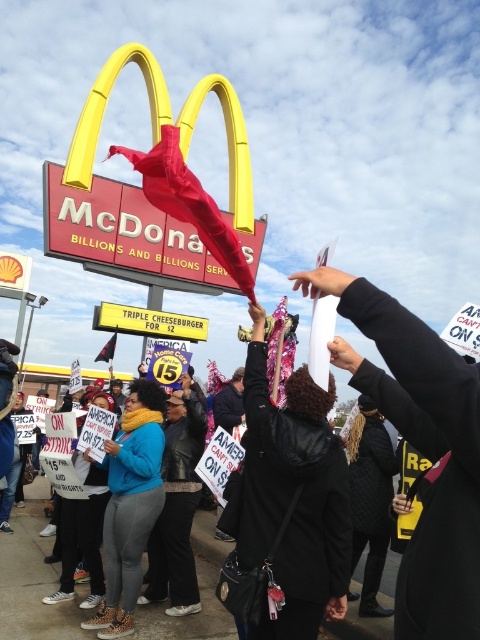
Question: Is black fabric hat at upper center behind black leather jacket at center?

Choices:
 (A) no
 (B) yes

Answer: (A)

Question: Which point is farther to the camera?

Choices:
 (A) (415, 376)
 (B) (108, 547)
 (C) (337, 605)

Answer: (B)

Question: Which object appears farthest from the camera in this image?

Choices:
 (A) black fabric hat at upper center
 (B) black leather jacket at center

Answer: (B)

Question: Can you confirm if black leather jacket at center is bigger than blue fleece jacket at center?

Choices:
 (A) no
 (B) yes

Answer: (B)

Question: Can you confirm if black leather jacket at center is bigger than blue fleece jacket at center?

Choices:
 (A) no
 (B) yes

Answer: (B)

Question: Which point appears farthest from the camera in this image?

Choices:
 (A) (450, 420)
 (B) (137, 476)
 (C) (323, 392)

Answer: (B)